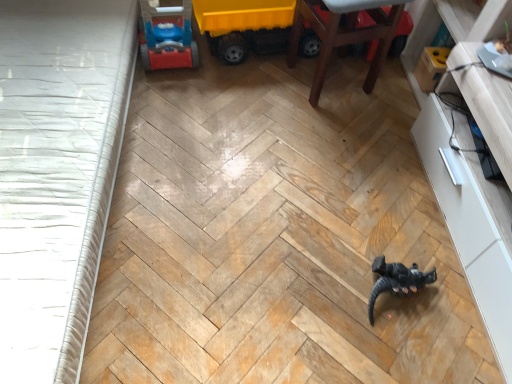
Identify the location of vacant region under wooden chair at upper right (from a real-world perspective). The image size is (512, 384). (329, 77).